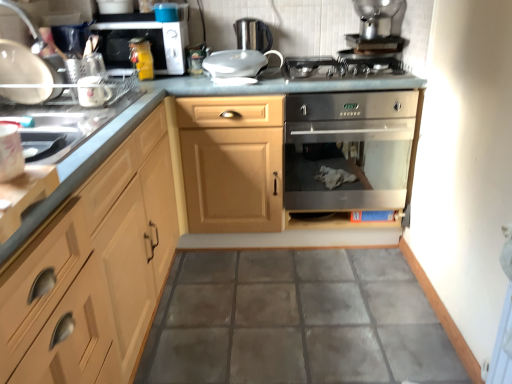
Question: Is satin silver kettle at upper center, marked as the fourth appliance in a left-to-right arrangement, facing away from stainless steel oven at center?

Choices:
 (A) yes
 (B) no

Answer: (B)

Question: From a real-world perspective, is satin silver kettle at upper center, the first appliance when ordered from back to front, located beneath stainless steel oven at center?

Choices:
 (A) yes
 (B) no

Answer: (B)

Question: Does satin silver kettle at upper center, arranged as the 2th appliance when viewed from the top, come in front of stainless steel oven at center?

Choices:
 (A) no
 (B) yes

Answer: (A)

Question: From the image's perspective, is satin silver kettle at upper center, the first appliance when ordered from back to front, over stainless steel oven at center?

Choices:
 (A) yes
 (B) no

Answer: (A)

Question: From a real-world perspective, is satin silver kettle at upper center, which is the 5th appliance from front to back, positioned over stainless steel oven at center based on gravity?

Choices:
 (A) no
 (B) yes

Answer: (B)

Question: Is white glossy mug at upper left, which appears as the 4th appliance when viewed from the top, bigger than shiny metallic pot at upper right, the fourth appliance viewed from the front?

Choices:
 (A) yes
 (B) no

Answer: (B)

Question: Does white glossy mug at upper left, which ranks as the first appliance in left-to-right order, appear on the right side of shiny metallic pot at upper right, the first appliance in the top-to-bottom sequence?

Choices:
 (A) yes
 (B) no

Answer: (B)

Question: Is shiny metallic pot at upper right, positioned as the 5th appliance in left-to-right order, completely or partially inside white glossy mug at upper left, which ranks as the first appliance in left-to-right order?

Choices:
 (A) yes
 (B) no

Answer: (B)

Question: Does white glossy mug at upper left, which is counted as the 5th appliance, starting from the right, have a lesser width compared to shiny metallic pot at upper right, the first appliance in the top-to-bottom sequence?

Choices:
 (A) yes
 (B) no

Answer: (A)

Question: From the image's perspective, is white glossy mug at upper left, which ranks as the first appliance in left-to-right order, on top of shiny metallic pot at upper right, positioned as the 5th appliance in left-to-right order?

Choices:
 (A) no
 (B) yes

Answer: (A)

Question: Can you confirm if white glossy mug at upper left, which is the fourth appliance in back-to-front order, is taller than shiny metallic pot at upper right, acting as the 2th appliance starting from the back?

Choices:
 (A) no
 (B) yes

Answer: (A)

Question: Is stainless steel oven at center to the left of stainless steel gas stove at center from the viewer's perspective?

Choices:
 (A) yes
 (B) no

Answer: (A)